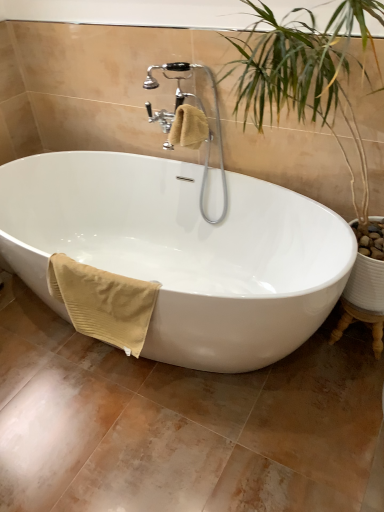
Question: Is polished chrome faucet at upper center located outside white glossy bathtub at center?

Choices:
 (A) no
 (B) yes

Answer: (A)

Question: Is polished chrome faucet at upper center taller than white glossy bathtub at center?

Choices:
 (A) no
 (B) yes

Answer: (B)

Question: Can you confirm if polished chrome faucet at upper center is thinner than white glossy bathtub at center?

Choices:
 (A) yes
 (B) no

Answer: (A)

Question: Considering the relative sizes of polished chrome faucet at upper center and white glossy bathtub at center in the image provided, is polished chrome faucet at upper center smaller than white glossy bathtub at center?

Choices:
 (A) yes
 (B) no

Answer: (A)

Question: From the image's perspective, is polished chrome faucet at upper center on top of white glossy bathtub at center?

Choices:
 (A) yes
 (B) no

Answer: (A)

Question: Is white glossy bathtub at center at the back of polished chrome faucet at upper center?

Choices:
 (A) no
 (B) yes

Answer: (A)

Question: From a real-world perspective, is beige ribbed towel at lower left, which is the second bath towel in right-to-left order, below polished chrome faucet at upper center?

Choices:
 (A) yes
 (B) no

Answer: (A)

Question: Is polished chrome faucet at upper center at the back of beige ribbed towel at lower left, which is counted as the 1th bath towel, starting from the left?

Choices:
 (A) yes
 (B) no

Answer: (A)

Question: Considering the relative positions of beige ribbed towel at lower left, acting as the first bath towel starting from the bottom, and polished chrome faucet at upper center in the image provided, is beige ribbed towel at lower left, acting as the first bath towel starting from the bottom, behind polished chrome faucet at upper center?

Choices:
 (A) no
 (B) yes

Answer: (A)

Question: Is beige ribbed towel at lower left, acting as the first bath towel starting from the bottom, positioned before polished chrome faucet at upper center?

Choices:
 (A) no
 (B) yes

Answer: (B)

Question: Considering the relative positions of beige ribbed towel at lower left, which is the second bath towel in right-to-left order, and polished chrome faucet at upper center in the image provided, is beige ribbed towel at lower left, which is the second bath towel in right-to-left order, to the left of polished chrome faucet at upper center from the viewer's perspective?

Choices:
 (A) yes
 (B) no

Answer: (A)

Question: Could you tell me if beige ribbed towel at lower left, which is counted as the 1th bath towel, starting from the left, is facing polished chrome faucet at upper center?

Choices:
 (A) yes
 (B) no

Answer: (B)

Question: Are beige cotton towel at upper center, placed as the first bath towel when sorted from right to left, and white glossy bathtub at center far apart?

Choices:
 (A) no
 (B) yes

Answer: (A)